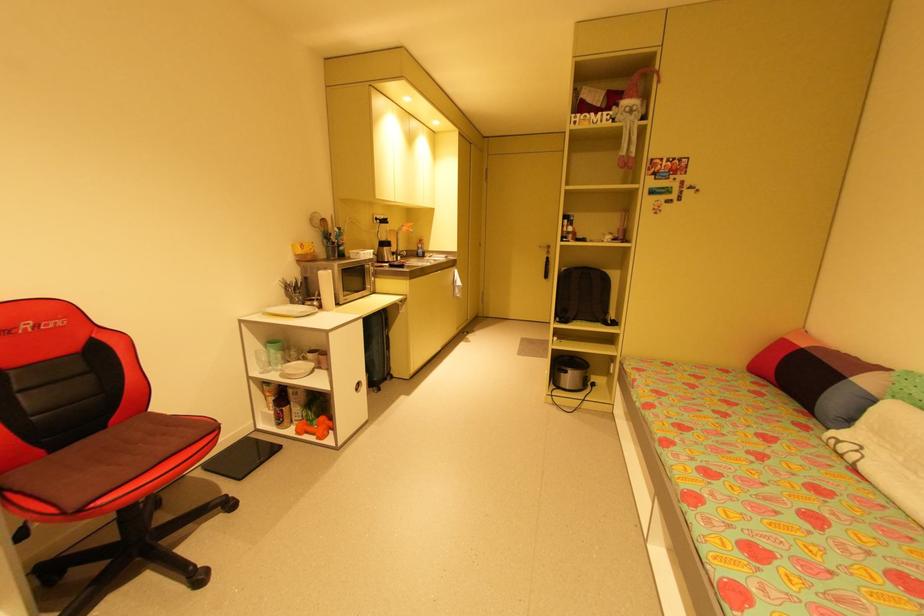
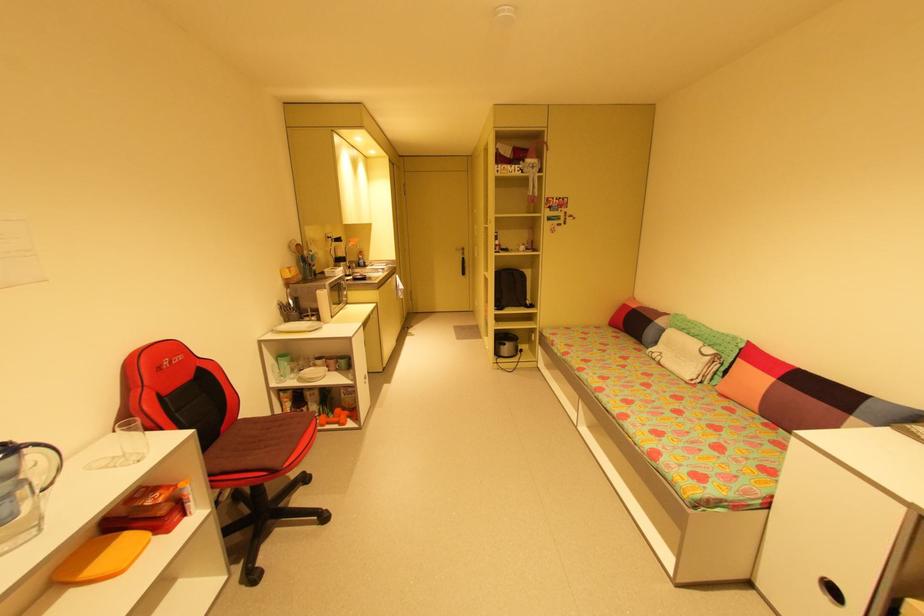
Where in the second image is the point corresponding to point 618,275 from the first image?

(532, 273)